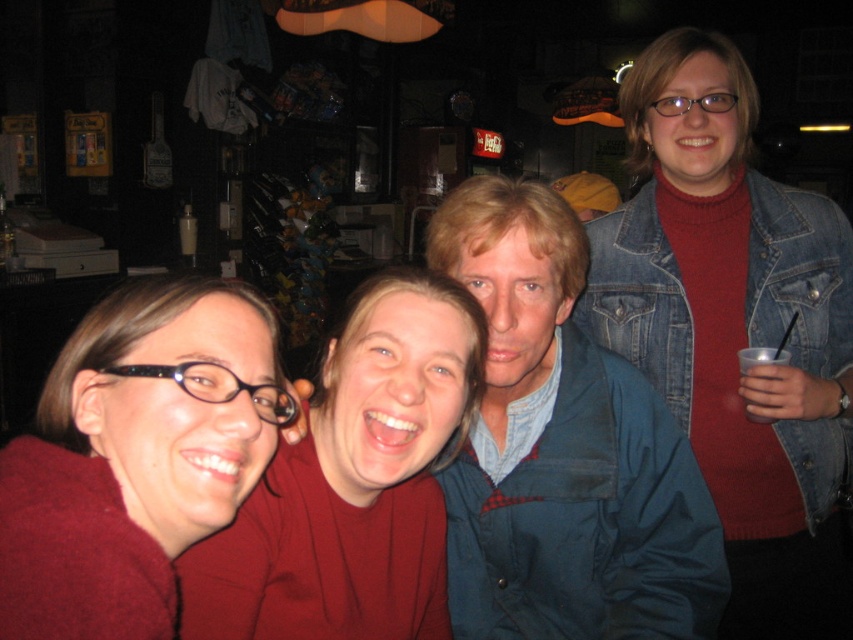
You are a photographer at the event and want to ensure all subjects are fully visible in the photo. Given the denim jacket at upper right and the matte red shirt at center, which one might require adjusting their position to avoid being cropped out of the frame?

The denim jacket at upper right is much taller than the matte red shirt at center, so it might require adjusting their position to avoid being cropped out of the frame.

You are planning to take a photo of the blue denim jacket at center and the matte red shirt at center. Which of the two objects would appear wider in the photo?

The blue denim jacket at center would appear wider in the photo since its width surpasses that of the matte red shirt at center.

In the scene shown: You are at a bar and want to hand a drink to both the denim jacket at upper right and the matte red shirt at center. Which person should you approach first to ensure you can reach them without moving?

You should approach the denim jacket at upper right first because it is closer to you than the matte red shirt at center, so you can reach them without moving.